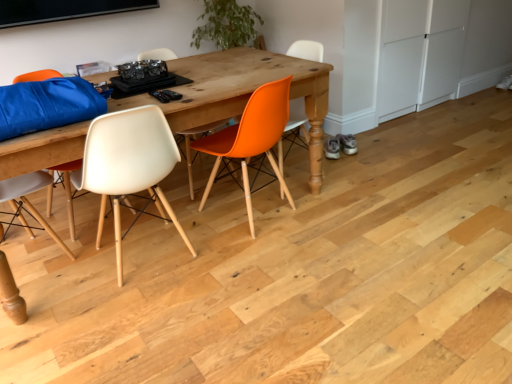
Question: Can you confirm if wooden table at center is shorter than orange matte chair at center, positioned as the 3th chair in left-to-right order?

Choices:
 (A) yes
 (B) no

Answer: (A)

Question: Considering the relative sizes of wooden table at center and orange matte chair at center, which ranks as the first chair in right-to-left order, in the image provided, is wooden table at center bigger than orange matte chair at center, which ranks as the first chair in right-to-left order,?

Choices:
 (A) no
 (B) yes

Answer: (B)

Question: Does wooden table at center lie behind orange matte chair at center, positioned as the 3th chair in left-to-right order?

Choices:
 (A) no
 (B) yes

Answer: (A)

Question: Is wooden table at center oriented away from orange matte chair at center, positioned as the 3th chair in left-to-right order?

Choices:
 (A) yes
 (B) no

Answer: (B)

Question: Does wooden table at center have a greater height compared to orange matte chair at center, which ranks as the first chair in right-to-left order?

Choices:
 (A) no
 (B) yes

Answer: (A)

Question: Is orange matte chair at center, positioned as the 3th chair in left-to-right order, spatially inside orange matte chair at center, arranged as the second chair when viewed from the right, or outside of it?

Choices:
 (A) outside
 (B) inside

Answer: (A)

Question: Visually, is orange matte chair at center, which ranks as the first chair in right-to-left order, positioned to the left or to the right of orange matte chair at center, which is counted as the 2th chair, starting from the left?

Choices:
 (A) left
 (B) right

Answer: (B)

Question: In terms of size, does orange matte chair at center, which ranks as the first chair in right-to-left order, appear bigger or smaller than orange matte chair at center, arranged as the second chair when viewed from the right?

Choices:
 (A) small
 (B) big

Answer: (A)

Question: Considering their positions, is orange matte chair at center, positioned as the 3th chair in left-to-right order, located in front of or behind orange matte chair at center, arranged as the second chair when viewed from the right?

Choices:
 (A) behind
 (B) front

Answer: (A)

Question: Is point (401, 107) closer or farther from the camera than point (313, 147)?

Choices:
 (A) closer
 (B) farther

Answer: (B)

Question: Based on their positions, is white matte cabinet at right located to the left or right of orange matte chair at center, which ranks as the first chair in right-to-left order?

Choices:
 (A) right
 (B) left

Answer: (A)

Question: In the image, is white matte cabinet at right positioned in front of or behind orange matte chair at center, which ranks as the first chair in right-to-left order?

Choices:
 (A) behind
 (B) front

Answer: (A)

Question: Considering the positions of white matte cabinet at right and orange matte chair at center, positioned as the 3th chair in left-to-right order, in the image, is white matte cabinet at right taller or shorter than orange matte chair at center, positioned as the 3th chair in left-to-right order,?

Choices:
 (A) short
 (B) tall

Answer: (B)

Question: From a real-world perspective, is orange matte chair at center, positioned as the 3th chair in left-to-right order, above or below white matte cabinet at right?

Choices:
 (A) above
 (B) below

Answer: (B)

Question: Is orange matte chair at center, positioned as the 3th chair in left-to-right order, bigger or smaller than white matte cabinet at right?

Choices:
 (A) big
 (B) small

Answer: (A)